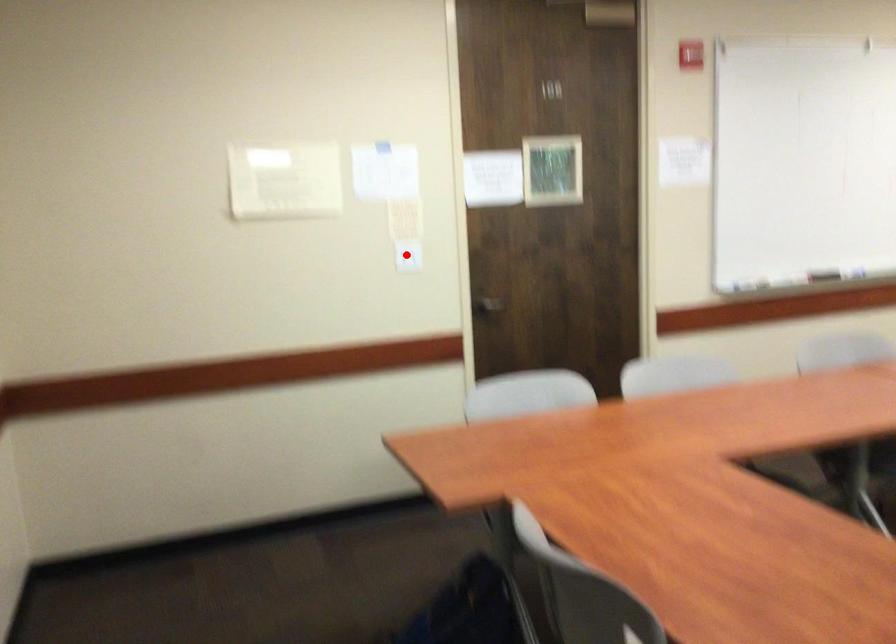
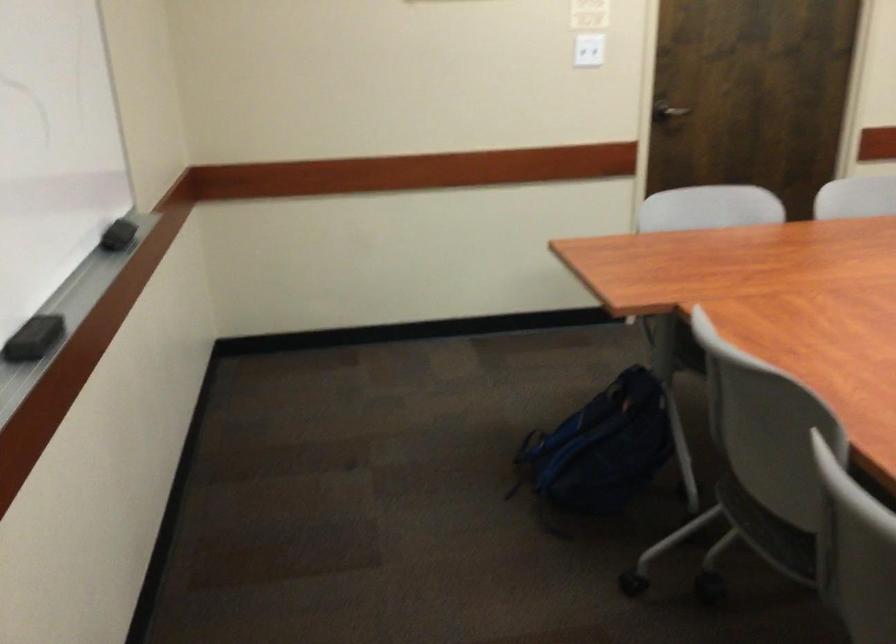
The point at the highlighted location is marked in the first image. Where is the corresponding point in the second image?

(588, 51)